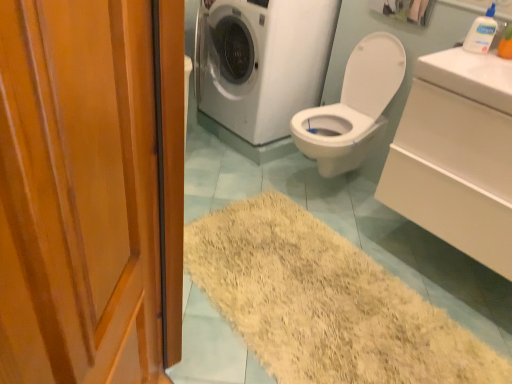
Question: Is white glossy sink at upper right, the second counter top when ordered from bottom to top, oriented away from white glossy washing machine at upper center?

Choices:
 (A) yes
 (B) no

Answer: (B)

Question: Is white glossy sink at upper right, marked as the first counter top in a top-to-bottom arrangement, not within white glossy washing machine at upper center?

Choices:
 (A) no
 (B) yes

Answer: (B)

Question: From a real-world perspective, is white glossy sink at upper right, marked as the first counter top in a top-to-bottom arrangement, located higher than white glossy washing machine at upper center?

Choices:
 (A) yes
 (B) no

Answer: (A)

Question: Is white glossy sink at upper right, marked as the first counter top in a top-to-bottom arrangement, shorter than white glossy washing machine at upper center?

Choices:
 (A) no
 (B) yes

Answer: (B)

Question: Considering the relative sizes of white glossy sink at upper right, marked as the first counter top in a top-to-bottom arrangement, and white glossy washing machine at upper center in the image provided, is white glossy sink at upper right, marked as the first counter top in a top-to-bottom arrangement, taller than white glossy washing machine at upper center?

Choices:
 (A) yes
 (B) no

Answer: (B)

Question: In the image, is wooden door at left positioned in front of or behind white glossy washing machine at upper center?

Choices:
 (A) front
 (B) behind

Answer: (A)

Question: Considering the positions of point (1, 221) and point (250, 23), is point (1, 221) closer or farther from the camera than point (250, 23)?

Choices:
 (A) farther
 (B) closer

Answer: (B)

Question: From the image's perspective, is wooden door at left above or below white glossy washing machine at upper center?

Choices:
 (A) below
 (B) above

Answer: (A)

Question: Considering the positions of wooden door at left and white glossy washing machine at upper center in the image, is wooden door at left bigger or smaller than white glossy washing machine at upper center?

Choices:
 (A) big
 (B) small

Answer: (B)

Question: Is white paper towel at upper center wider or thinner than clear plastic bottle at upper right?

Choices:
 (A) thin
 (B) wide

Answer: (B)

Question: Relative to clear plastic bottle at upper right, is white paper towel at upper center in front or behind?

Choices:
 (A) front
 (B) behind

Answer: (B)

Question: Is white paper towel at upper center bigger or smaller than clear plastic bottle at upper right?

Choices:
 (A) small
 (B) big

Answer: (B)

Question: Would you say white paper towel at upper center is inside or outside clear plastic bottle at upper right?

Choices:
 (A) inside
 (B) outside

Answer: (B)

Question: Is wooden door at left wider or thinner than white glossy sink at upper right, which is counted as the 1th counter top, starting from the bottom?

Choices:
 (A) thin
 (B) wide

Answer: (A)

Question: Is wooden door at left in front of or behind white glossy sink at upper right, which is counted as the 1th counter top, starting from the bottom, in the image?

Choices:
 (A) behind
 (B) front

Answer: (B)